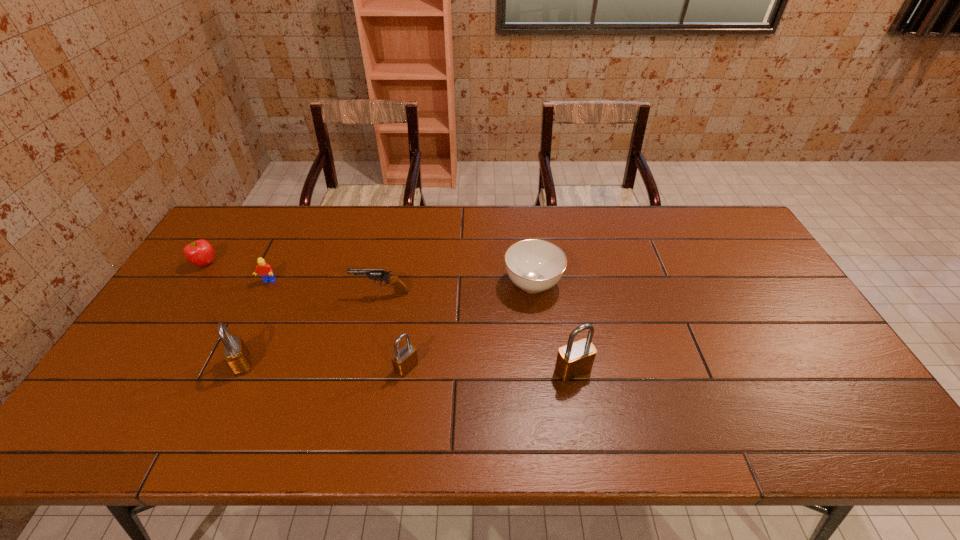
Identify the location of free region at the near edge of the desktop. The image size is (960, 540). (748, 399).

In the image, there is a desktop. Where is `blank space at the left edge`? Image resolution: width=960 pixels, height=540 pixels. blank space at the left edge is located at coordinates (198, 289).

The height and width of the screenshot is (540, 960). In the image, there is a desktop. In order to click on vacant space at the right edge in this screenshot , I will do `click(756, 281)`.

In the image, there is a desktop. At what (x,y) coordinates should I click in order to perform the action: click on vacant space at the near left corner. Please return your answer as a coordinate pair (x, y). Looking at the image, I should click on (175, 382).

At what (x,y) coordinates should I click in order to perform the action: click on vacant space at the far right corner of the desktop. Please return your answer as a coordinate pair (x, y). Looking at the image, I should click on (x=704, y=245).

Locate an element on the screen. The image size is (960, 540). empty location between the sixth shortest object and the apple is located at coordinates (224, 314).

The width and height of the screenshot is (960, 540). What are the coordinates of `free space between the Lego and the shortest padlock` in the screenshot? It's located at (337, 325).

Identify the location of free spot between the gun and the leftmost padlock. (311, 329).

The image size is (960, 540). I want to click on unoccupied position between the gun and the rightmost padlock, so click(477, 332).

The height and width of the screenshot is (540, 960). I want to click on vacant area that lies between the shortest padlock and the second tallest padlock, so click(324, 365).